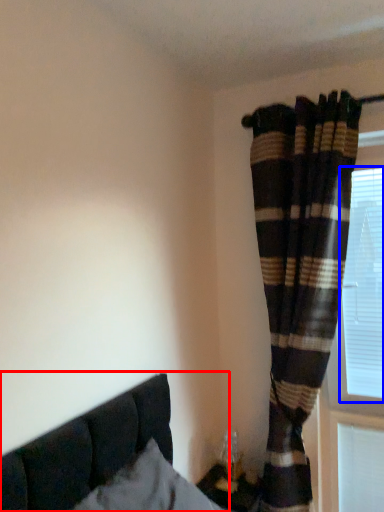
Question: Which point is further to the camera, bed (highlighted by a red box) or bay window (highlighted by a blue box)?

Choices:
 (A) bed
 (B) bay window

Answer: (B)